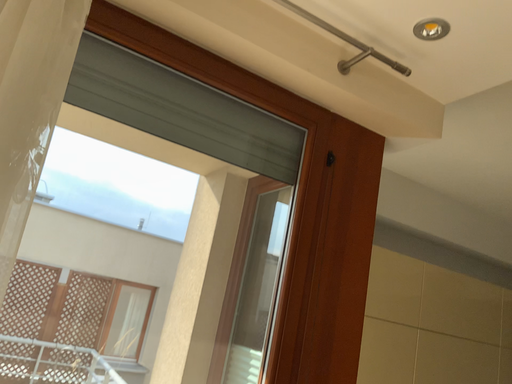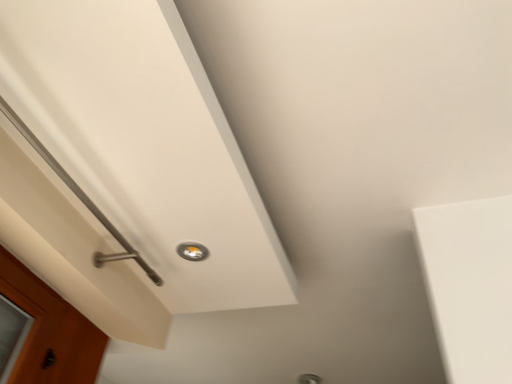
Question: Which way did the camera rotate in the video?

Choices:
 (A) rotated upward
 (B) rotated downward

Answer: (A)